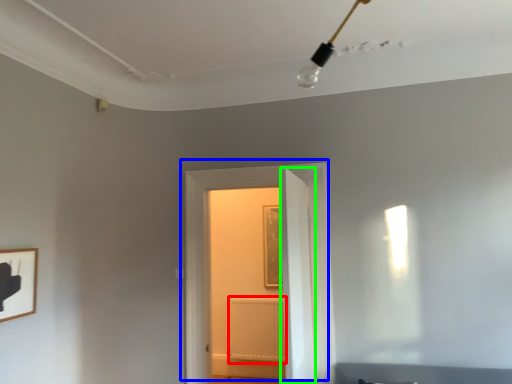
Question: Which object is positioned closest to radiator (highlighted by a red box)? Select from door (highlighted by a blue box) and door (highlighted by a green box).

Choices:
 (A) door
 (B) door

Answer: (A)